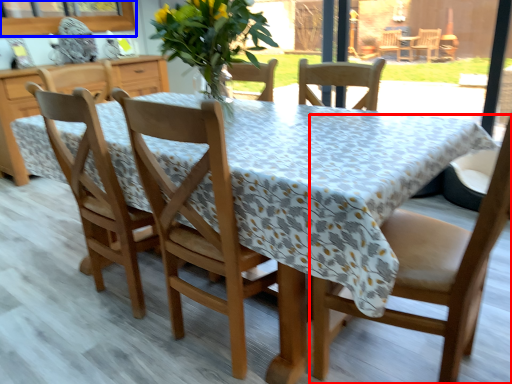
Question: Which point is further to the camera, chair (highlighted by a red box) or window screen (highlighted by a blue box)?

Choices:
 (A) chair
 (B) window screen

Answer: (B)